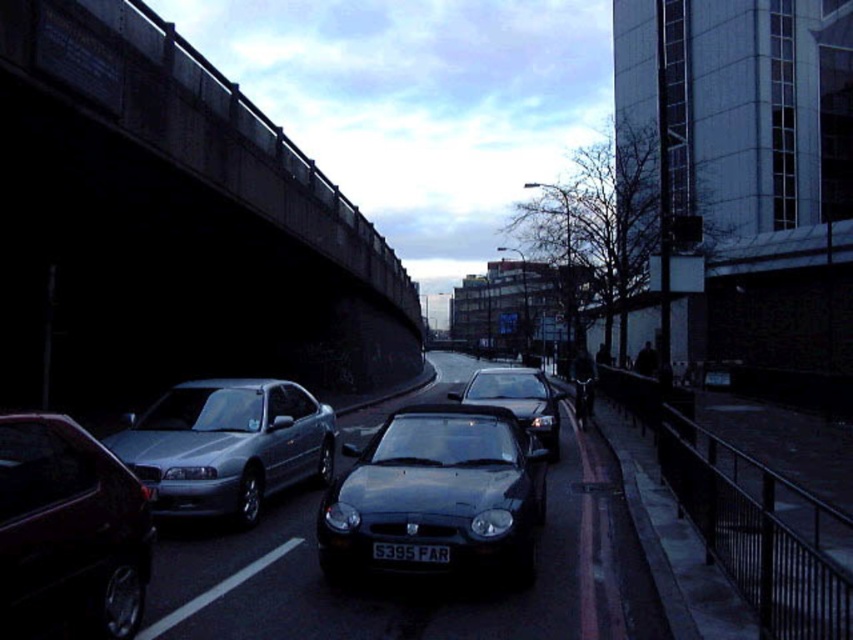
Question: Can you confirm if satin black convertible at center is wider than satin silver sedan at center?

Choices:
 (A) no
 (B) yes

Answer: (A)

Question: Is satin black convertible at center thinner than shiny black car at center?

Choices:
 (A) yes
 (B) no

Answer: (A)

Question: Which point is closer to the camera?

Choices:
 (A) satin black convertible at center
 (B) satin silver sedan at center
 (C) shiny metallic car at left

Answer: (C)

Question: Among these points, which one is farthest from the camera?

Choices:
 (A) (329, 433)
 (B) (431, 545)

Answer: (A)

Question: Estimate the real-world distances between objects in this image. Which object is farther from the concrete bridge at upper left?

Choices:
 (A) shiny black car at center
 (B) satin silver sedan at center
 (C) black plastic license plate at center

Answer: (B)

Question: Observing the image, what is the correct spatial positioning of satin black convertible at center in reference to satin silver sedan at center?

Choices:
 (A) above
 (B) below

Answer: (B)